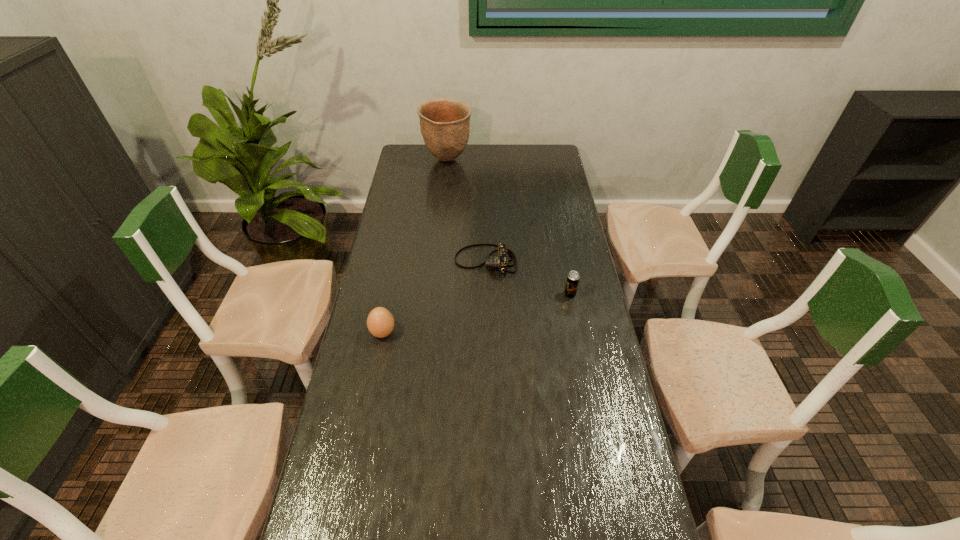
This screenshot has height=540, width=960. What are the coordinates of `vacant point located between the rightmost object and the pottery` in the screenshot? It's located at (509, 227).

In order to click on empty space that is in between the beer can and the tallest object in this screenshot , I will do `click(509, 227)`.

At what (x,y) coordinates should I click in order to perform the action: click on vacant region between the pottery and the shortest object. Please return your answer as a coordinate pair (x, y). The image size is (960, 540). Looking at the image, I should click on (467, 211).

Identify which object is the closest to the third farthest object. Please provide its 2D coordinates. Your answer should be formatted as a tuple, i.e. [(x, y)], where the tuple contains the x and y coordinates of a point satisfying the conditions above.

[(500, 261)]

Where is `object that is the third closest to the beer can`? The image size is (960, 540). object that is the third closest to the beer can is located at coordinates (445, 123).

You are a GUI agent. You are given a task and a screenshot of the screen. Output one action in this format:
    pyautogui.click(x=<x>, y=<y>)
    Task: Click on the blank space that satisfies the following two spatial constraints: 1. on the back side of the tallest object; 2. on the left side of the nearest object
    
    Given the screenshot: What is the action you would take?
    pyautogui.click(x=417, y=160)

You are a GUI agent. You are given a task and a screenshot of the screen. Output one action in this format:
    pyautogui.click(x=<x>, y=<y>)
    Task: Click on the vacant space that satisfies the following two spatial constraints: 1. on the front-facing side of the shortest object; 2. on the right side of the third farthest object
    The height and width of the screenshot is (540, 960).
    Given the screenshot: What is the action you would take?
    pyautogui.click(x=486, y=294)

Find the location of a particular element. vacant space that satisfies the following two spatial constraints: 1. on the back side of the second nearest object; 2. on the front-facing side of the third nearest object is located at coordinates (564, 262).

Locate an element on the screen. The width and height of the screenshot is (960, 540). free space in the image that satisfies the following two spatial constraints: 1. on the back side of the boiled egg; 2. on the right side of the pottery is located at coordinates (417, 160).

The height and width of the screenshot is (540, 960). I want to click on vacant region that satisfies the following two spatial constraints: 1. on the back side of the tallest object; 2. on the left side of the boiled egg, so click(x=417, y=160).